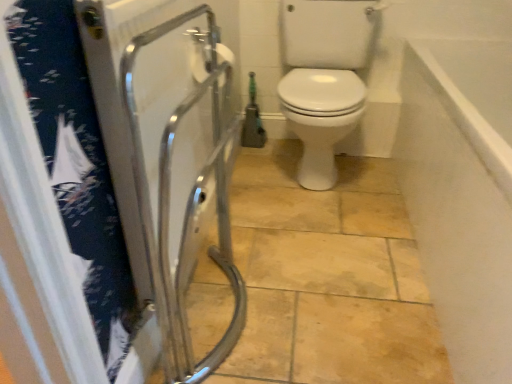
Question: From a real-world perspective, is white matte toilet paper at upper center physically located above or below white smooth wall at upper right?

Choices:
 (A) below
 (B) above

Answer: (B)

Question: Considering the positions of white matte toilet paper at upper center and white smooth wall at upper right in the image, is white matte toilet paper at upper center bigger or smaller than white smooth wall at upper right?

Choices:
 (A) small
 (B) big

Answer: (A)

Question: Estimate the real-world distances between objects in this image. Which object is closer to the transparent plastic screen door at left?

Choices:
 (A) white matte toilet paper at upper center
 (B) white smooth wall at upper right

Answer: (A)

Question: Considering the real-world distances, which object is farthest from the white smooth wall at upper right?

Choices:
 (A) transparent plastic screen door at left
 (B) white matte toilet paper at upper center

Answer: (B)